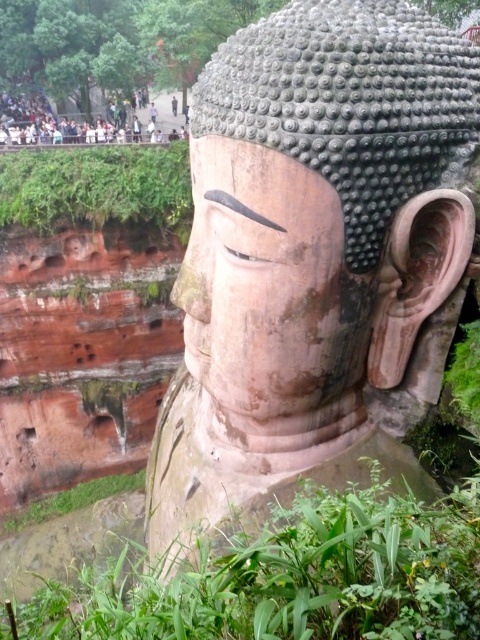
Question: Where is smooth stone statue at center located in relation to green leafy plant at lower center in the image?

Choices:
 (A) below
 (B) above

Answer: (B)

Question: Based on their relative distances, which object is farther from the green mossy rock at upper left?

Choices:
 (A) smooth stone statue at center
 (B) smooth stone face at center
 (C) green leafy plant at lower center

Answer: (C)

Question: Can you confirm if smooth stone face at center is smaller than green mossy rock at upper left?

Choices:
 (A) yes
 (B) no

Answer: (A)

Question: Which object appears farthest from the camera in this image?

Choices:
 (A) smooth stone face at center
 (B) smooth stone statue at center

Answer: (A)

Question: Can you confirm if green leafy plant at lower center is positioned below smooth stone face at center?

Choices:
 (A) no
 (B) yes

Answer: (B)

Question: Which of these objects is positioned farthest from the green mossy rock at upper left?

Choices:
 (A) smooth stone statue at center
 (B) smooth stone face at center
 (C) green leafy plant at lower center

Answer: (C)